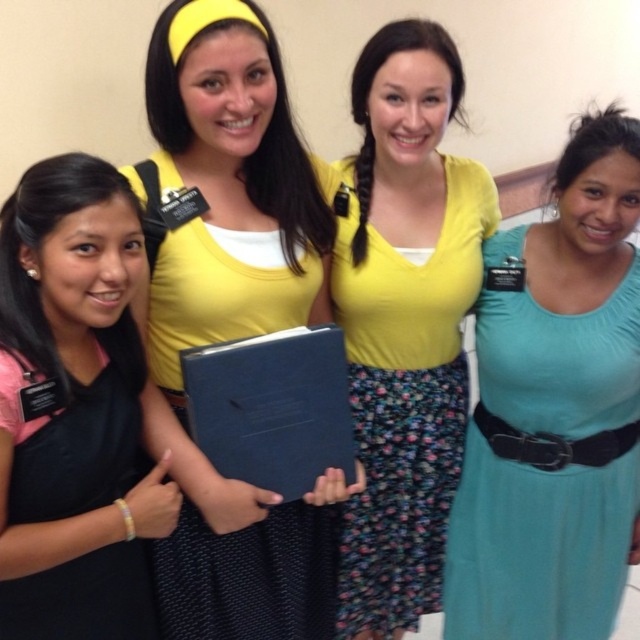
What do you see at coordinates (74, 410) in the screenshot? This screenshot has width=640, height=640. I see `matte black book at center` at bounding box center [74, 410].

Is matte black book at center thinner than floral print fabric dress at center?

Yes.

Is point (81, 618) closer to viewer compared to point (365, 605)?

Yes.

The image size is (640, 640). Find the location of `matte black book at center`. matte black book at center is located at coordinates (74, 410).

Which of these two, matte yellow shirt at center or blue matte folder at center, stands shorter?

Standing shorter between the two is blue matte folder at center.

Is matte yellow shirt at center closer to camera compared to blue matte folder at center?

Yes.

Describe the element at coordinates (230, 316) in the screenshot. I see `matte yellow shirt at center` at that location.

This screenshot has width=640, height=640. In order to click on matte yellow shirt at center in this screenshot , I will do `click(230, 316)`.

Can you confirm if teal satin dress at right is bigger than black matte dress at left?

Correct, teal satin dress at right is larger in size than black matte dress at left.

Which is above, teal satin dress at right or black matte dress at left?

teal satin dress at right

Does point (586, 477) come closer to viewer compared to point (4, 416)?

No, (586, 477) is behind (4, 416).

Where is `teal satin dress at right`? Image resolution: width=640 pixels, height=640 pixels. teal satin dress at right is located at coordinates (545, 465).